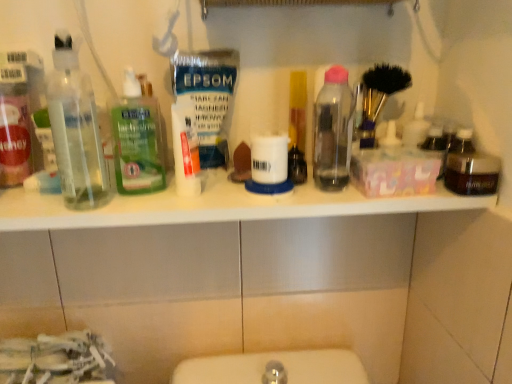
Where is `spots to the right of transparent plastic bottles at left, positioned as the fourth bottle in right-to-left order`? The width and height of the screenshot is (512, 384). spots to the right of transparent plastic bottles at left, positioned as the fourth bottle in right-to-left order is located at coordinates (185, 202).